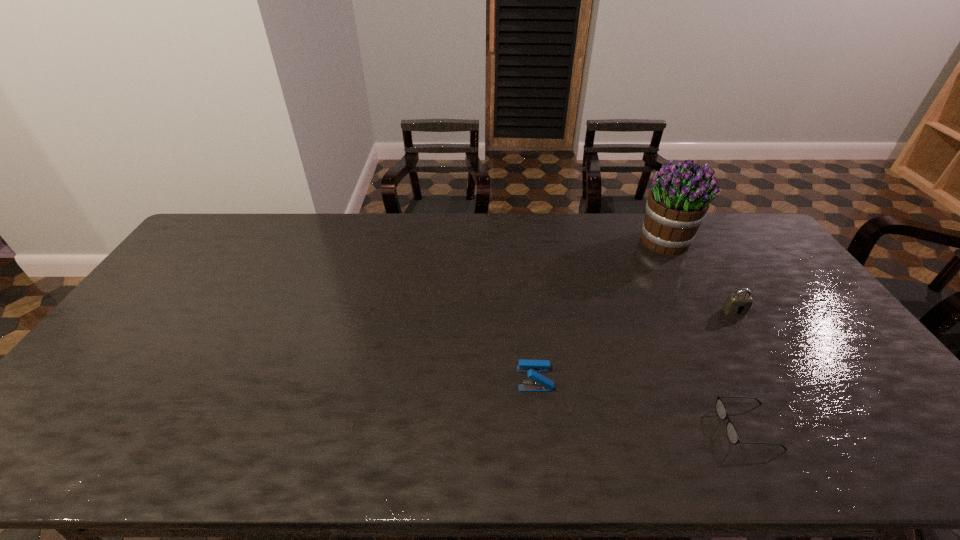
Where is `the farthest object`? the farthest object is located at coordinates (677, 203).

This screenshot has width=960, height=540. What are the coordinates of `bouquet` in the screenshot? It's located at (677, 203).

The height and width of the screenshot is (540, 960). Find the location of `the second farthest object`. the second farthest object is located at coordinates (737, 304).

In order to click on padlock in this screenshot , I will do `click(737, 304)`.

In order to click on the third tallest object in this screenshot , I will do `click(541, 383)`.

Image resolution: width=960 pixels, height=540 pixels. What are the coordinates of `stapler` in the screenshot? It's located at [x=541, y=383].

Find the location of a particular element. spectacles is located at coordinates [732, 434].

Locate an element on the screen. the shortest object is located at coordinates (732, 434).

Find the location of a particular element. This screenshot has width=960, height=540. free space located 0.240m on the left of the farthest object is located at coordinates (568, 242).

Find the location of a particular element. The width and height of the screenshot is (960, 540). free space located 0.050m at the front of the third nearest object near the keyhole is located at coordinates (745, 328).